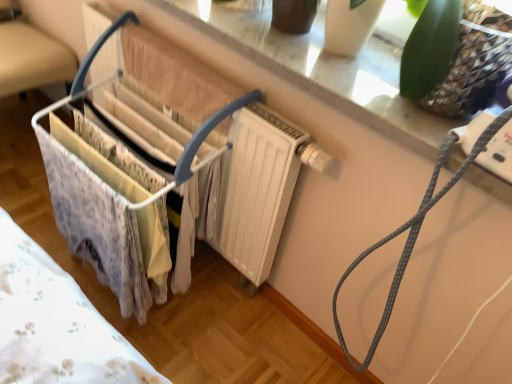
Question: From a real-world perspective, is metallic wire basket at left physically located above or below white glossy window sill at upper center?

Choices:
 (A) below
 (B) above

Answer: (A)

Question: Does point (69, 54) appear closer or farther from the camera than point (384, 92)?

Choices:
 (A) farther
 (B) closer

Answer: (A)

Question: Which object is positioned closest to the white glossy window sill at upper center?

Choices:
 (A) white plastic baby carriage at left
 (B) metallic wire basket at left
 (C) gray dotted string at upper right

Answer: (C)

Question: Which of these objects is positioned closest to the gray dotted string at upper right?

Choices:
 (A) white glossy window sill at upper center
 (B) white plastic baby carriage at left
 (C) metallic wire basket at left

Answer: (A)